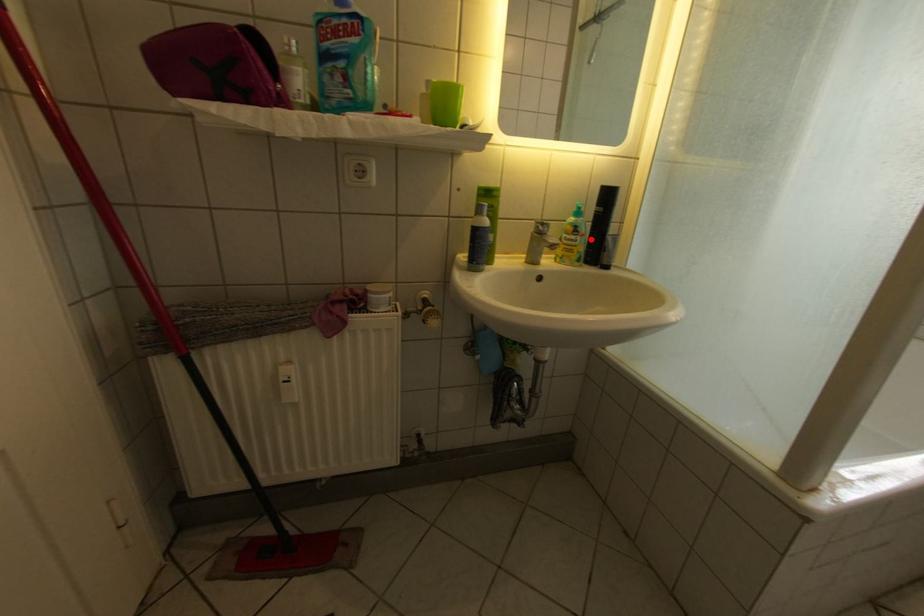
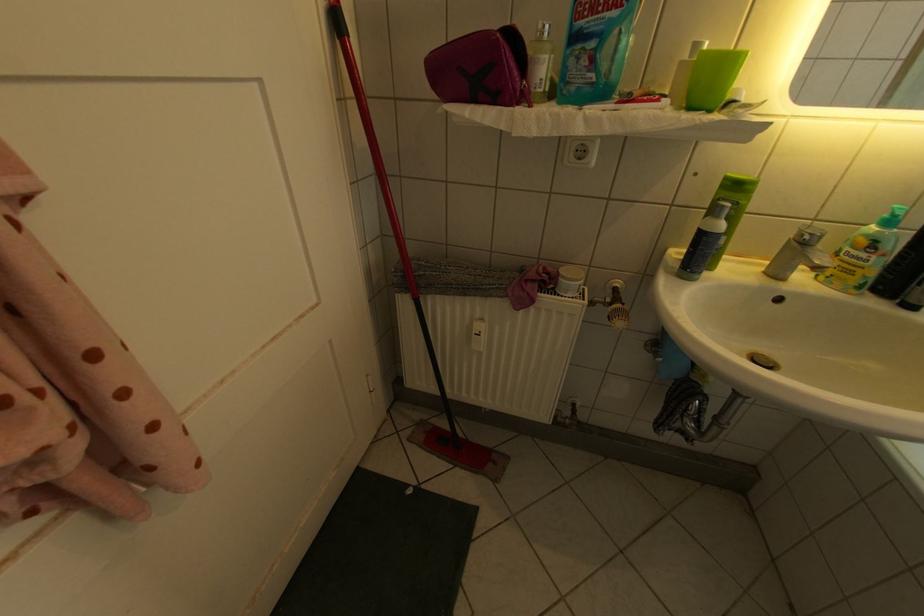
In the second image, find the point that corresponds to the highlighted location in the first image.

(888, 257)